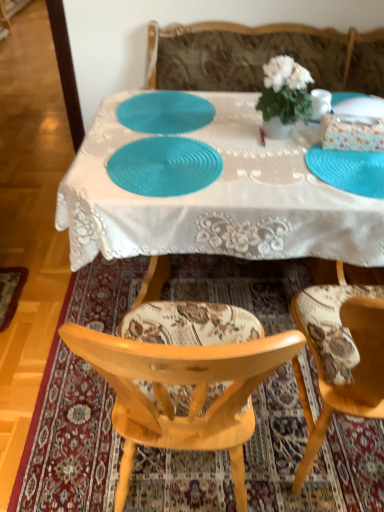
Find the location of `free point above floral fabric chair at lower center (from a real-world perspective)`. free point above floral fabric chair at lower center (from a real-world perspective) is located at coordinates (215, 298).